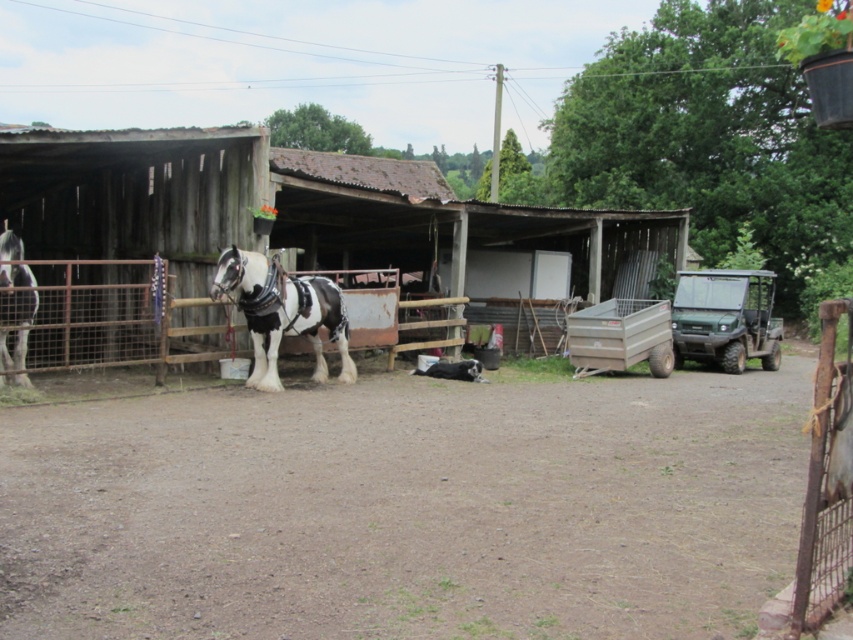
You are standing at the origin point of the image coordinate system, which is the bottom left corner. The spotted glossy horse at center is at point [282,312]. If you want to walk directly to the spotted glossy horse at center, in which direction should you move? Please provide your answer in terms of the coordinate system where the x and y axes increase to the right and up respectively.

To reach the spotted glossy horse at center located at point [282,312] from the origin at the bottom left corner, you should move in the positive x and positive y direction since both coordinates are greater than zero.